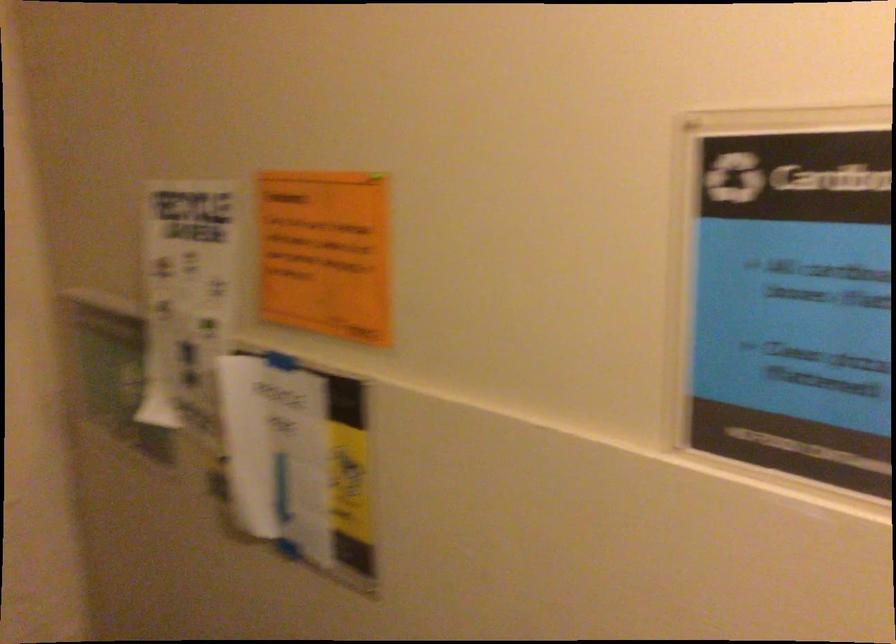
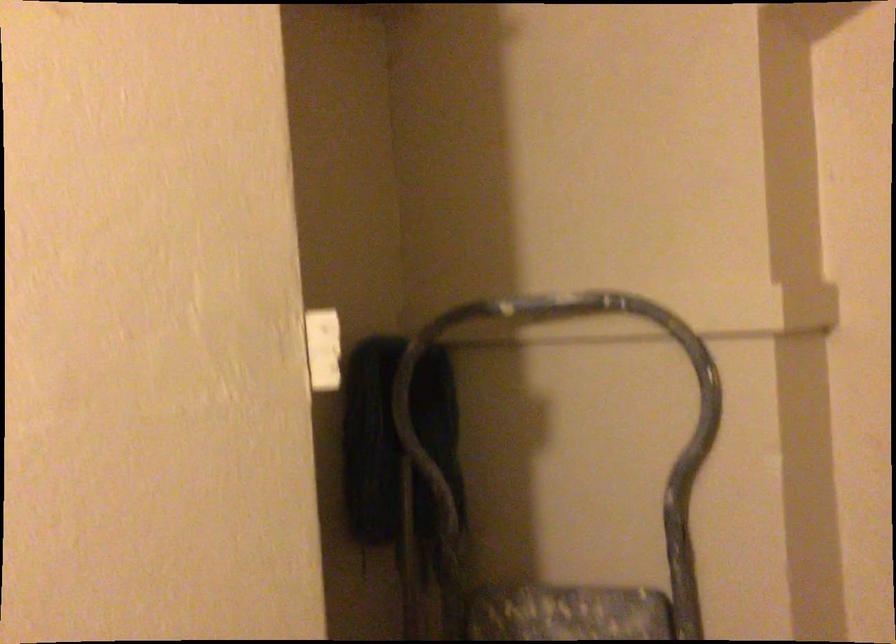
Question: Based on the continuous images, in which direction is the camera rotating? Reply with the corresponding letter.

Choices:
 (A) Left
 (B) Right
 (C) Up
 (D) Down

Answer: (A)